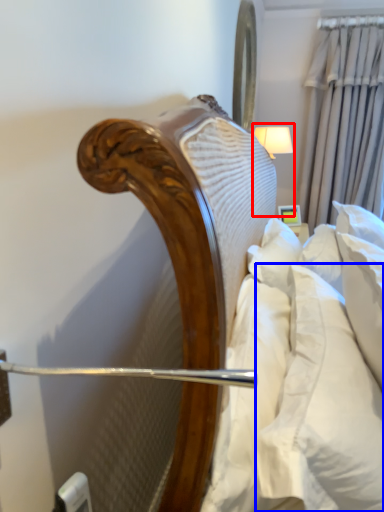
Question: Which point is further to the camera, bedside lamp (highlighted by a red box) or pillow (highlighted by a blue box)?

Choices:
 (A) bedside lamp
 (B) pillow

Answer: (A)